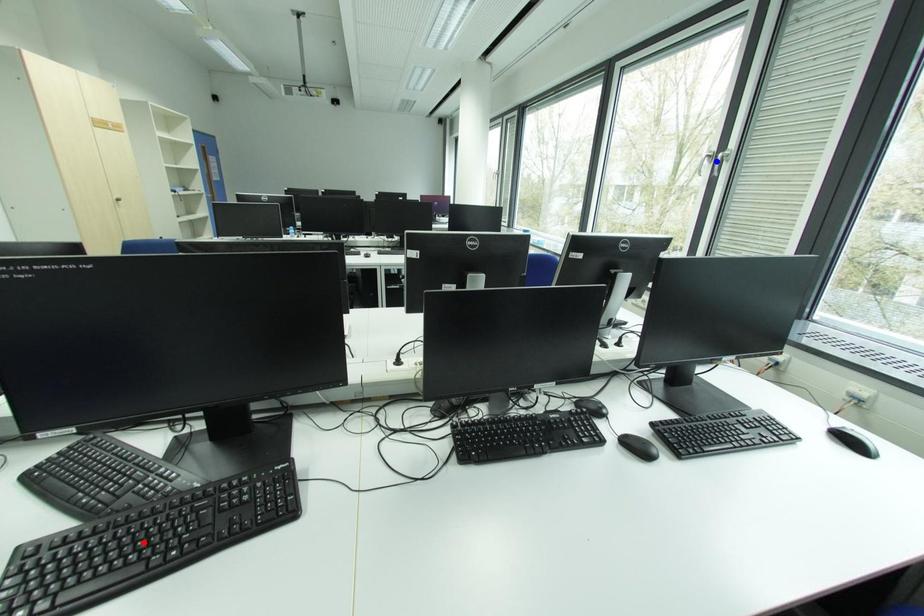
Question: Two points are marked on the image. Which point is closer to the camera?

Choices:
 (A) Blue point is closer.
 (B) Red point is closer.

Answer: (B)